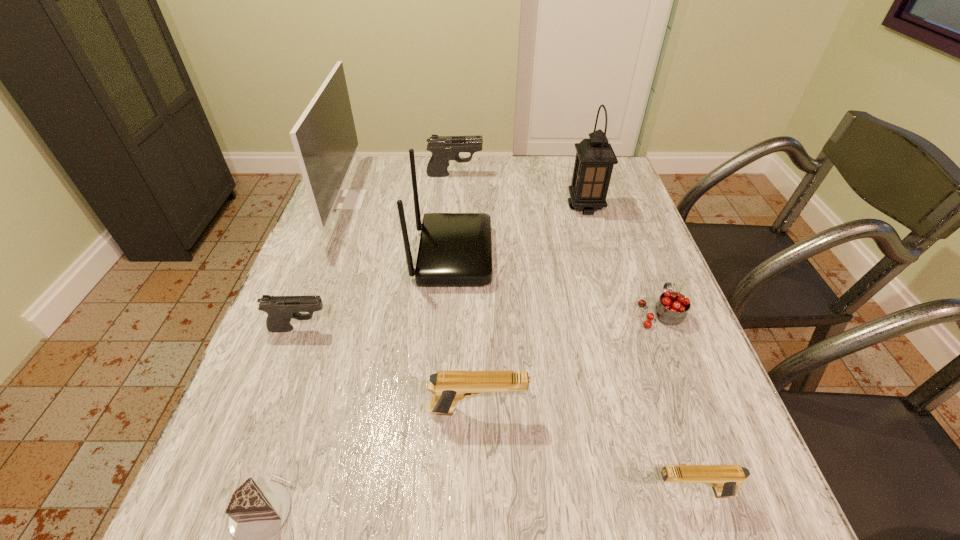
Image resolution: width=960 pixels, height=540 pixels. What are the coordinates of `empty location between the seventh farthest object and the smaller tan pistol` in the screenshot? It's located at (585, 451).

I want to click on free area in between the seventh farthest object and the cherry, so click(568, 362).

Find the location of a particular element. This screenshot has height=540, width=960. empty space between the fourth tallest object and the bigger tan pistol is located at coordinates (466, 292).

You are a GUI agent. You are given a task and a screenshot of the screen. Output one action in this format:
    pyautogui.click(x=<x>, y=<y>)
    Task: Click on the unoccupied area between the nearer black pistol and the shortest pistol
    The height and width of the screenshot is (540, 960).
    Given the screenshot: What is the action you would take?
    pyautogui.click(x=496, y=410)

I want to click on free space that is in between the leftmost pistol and the fourth tallest object, so click(377, 252).

Locate an element on the screen. free space that is in between the nearer tan pistol and the fourth tallest object is located at coordinates (573, 334).

Find the location of a particular element. Image resolution: width=960 pixels, height=540 pixels. object identified as the seventh closest to the chocolate cake is located at coordinates (595, 158).

Where is `object that stands as the fifth closest to the smaller black pistol`? The height and width of the screenshot is (540, 960). object that stands as the fifth closest to the smaller black pistol is located at coordinates (443, 148).

The width and height of the screenshot is (960, 540). I want to click on pistol identified as the closest to the black monitor, so click(443, 148).

Choose which pistol is the nearest neighbor to the black lantern. Please provide its 2D coordinates. Your answer should be formatted as a tuple, i.e. [(x, y)], where the tuple contains the x and y coordinates of a point satisfying the conditions above.

[(443, 148)]